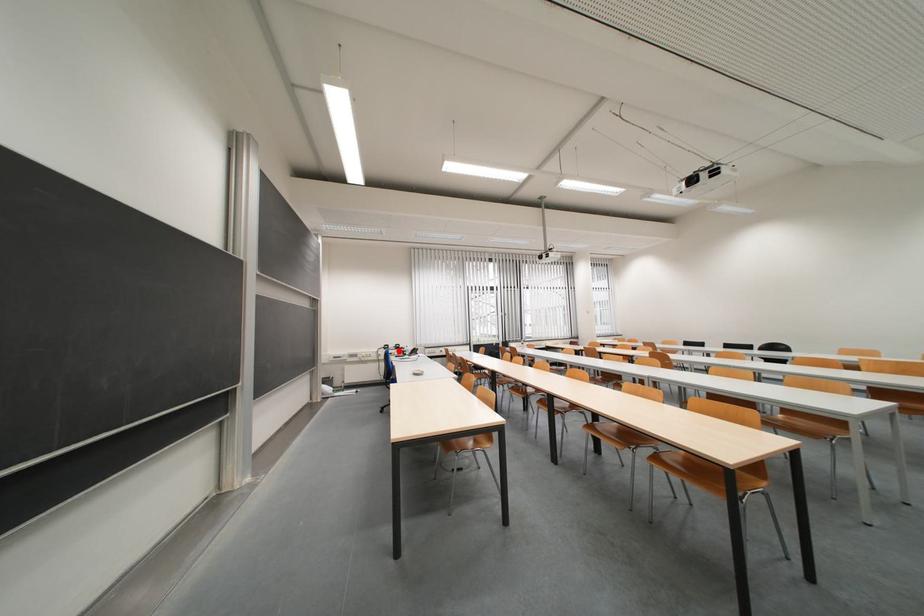
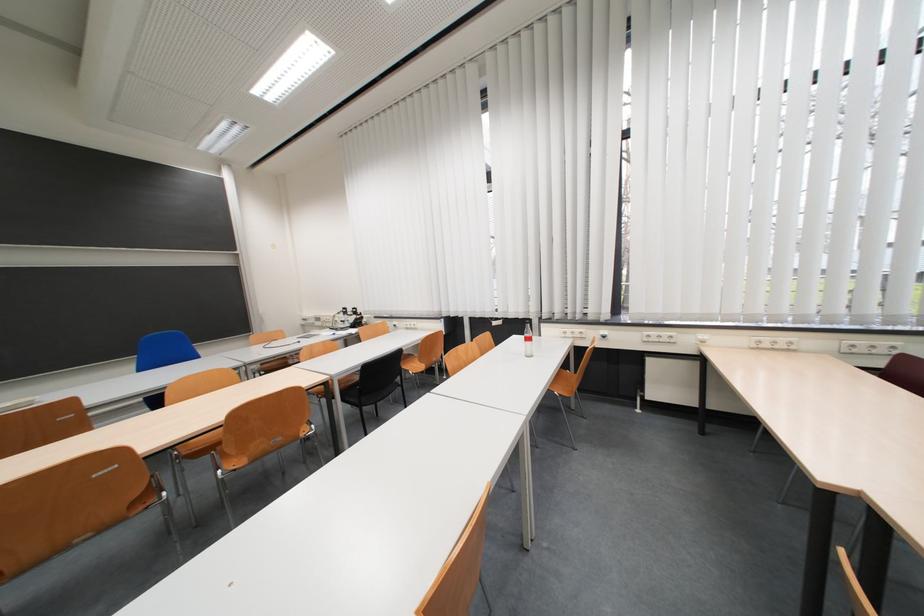
Where in the second image is the point corresponding to the highlighted location from the first image?

(357, 315)